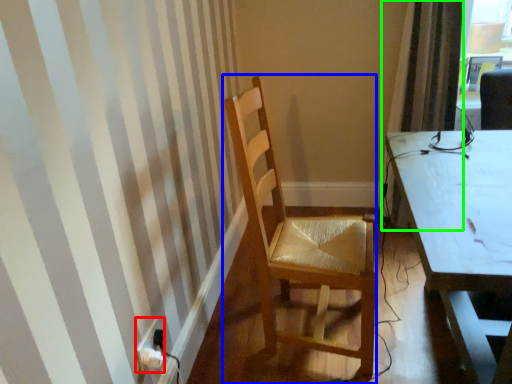
Question: Considering the real-world distances, which object is farthest from power plugs and sockets (highlighted by a red box)? chair (highlighted by a blue box) or curtain (highlighted by a green box)?

Choices:
 (A) chair
 (B) curtain

Answer: (B)